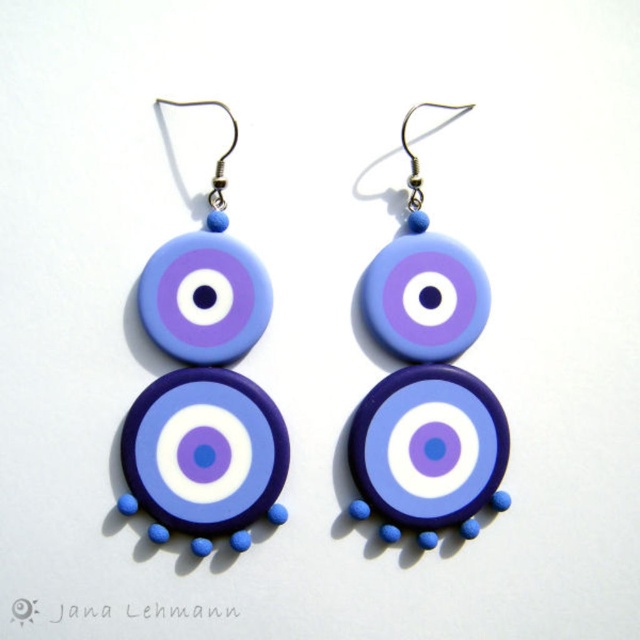
You are holding a ruler and want to measure the distance between the point at coordinates point (234, 481) and your eyes. Can you do this without moving your head?

The distance between point (234, 481) and the viewer is 1.24 meters, so yes, you can measure it as 1.24 meters without moving your head.

You are an artist analyzing the symmetry of the earrings in the image. You notice a specific point marked as point (205, 381). Based on the description, what does this point represent in the earring design?

→ The point (205, 381) represents the matte clay eye at the center of the earring design.